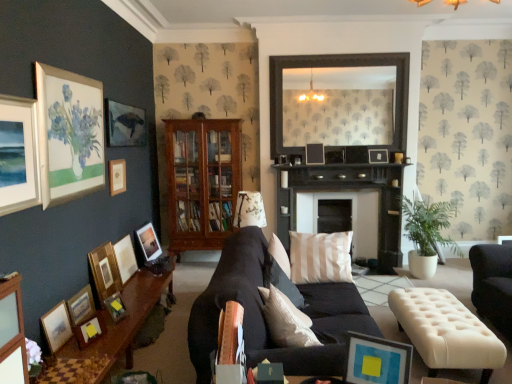
Question: Would you say wooden picture frame at lower left, acting as the 3th picture frame starting from the left, is inside or outside wooden picture frame at upper center, which appears as the 12th picture frame when viewed from the left?

Choices:
 (A) outside
 (B) inside

Answer: (A)

Question: From the image's perspective, is wooden picture frame at lower left, placed as the 11th picture frame when sorted from right to left, located above or below wooden picture frame at upper center, which appears as the 12th picture frame when viewed from the left?

Choices:
 (A) below
 (B) above

Answer: (A)

Question: Based on their relative distances, which object is farther from the beige tufted ottoman at lower right?

Choices:
 (A) matte white picture frame at upper left, which is counted as the thirteenth picture frame, starting from the right
 (B) matte wooden picture frame at center, positioned as the seventh picture frame in left-to-right order
 (C) wooden picture frame at left, placed as the 8th picture frame when sorted from right to left
 (D) matte black picture frame at upper center, which ranks as the fourth picture frame in right-to-left order
 (E) white painted wood fireplace at center

Answer: (D)

Question: Which is nearer to the wooden picture frame at left, the sixth picture frame viewed from the left?

Choices:
 (A) black wooden mirror at upper center
 (B) matte wooden picture frame at lower left, marked as the twelfth picture frame in a right-to-left arrangement
 (C) green leafy plant at right
 (D) matte gold picture frame at upper left, which is the 4th picture frame in left-to-right order
 (E) white painted wood fireplace at center

Answer: (B)